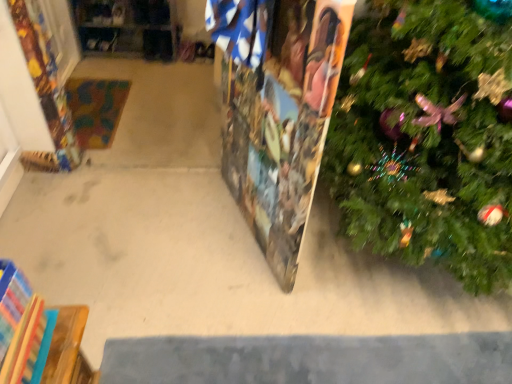
Question: Choose the correct answer: Is wooden puzzle piece at center inside green textured christmas tree at right or outside it?

Choices:
 (A) outside
 (B) inside

Answer: (A)

Question: From a real-world perspective, is wooden puzzle piece at center physically located above or below green textured christmas tree at right?

Choices:
 (A) below
 (B) above

Answer: (A)

Question: Considering the real-world distances, which object is closest to the wooden at left?

Choices:
 (A) green textured christmas tree at right
 (B) wooden puzzle piece at center

Answer: (B)

Question: Which object is the farthest from the wooden puzzle piece at center?

Choices:
 (A) wooden at left
 (B) green textured christmas tree at right

Answer: (A)